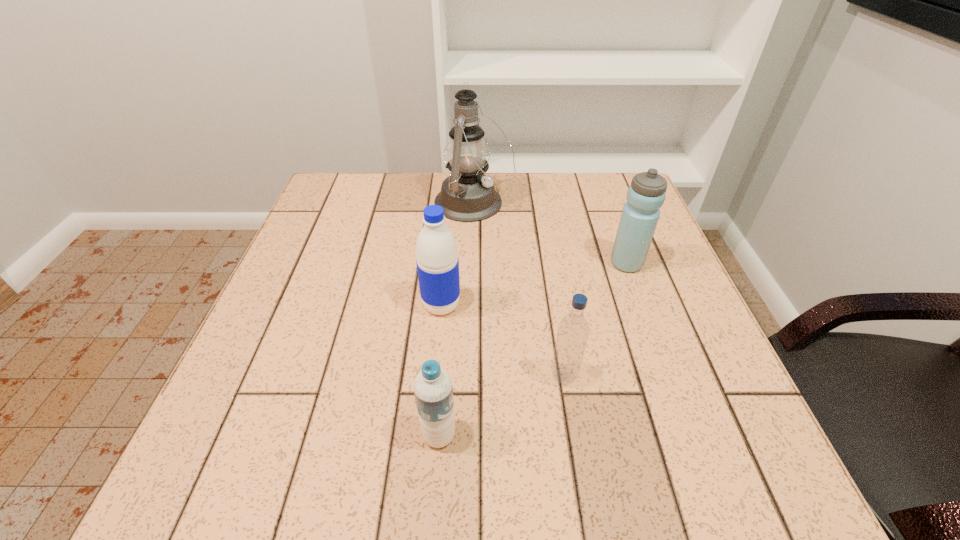
Identify the location of blank space located 0.190m on the right of the third nearest water bottle. Image resolution: width=960 pixels, height=540 pixels. (553, 305).

This screenshot has width=960, height=540. What are the coordinates of `vacant space situated 0.390m on the left of the third water bottle from left to right` in the screenshot? It's located at (329, 376).

The image size is (960, 540). Identify the location of vacant space situated on the label of the nearest object. (708, 435).

The height and width of the screenshot is (540, 960). I want to click on object at the far edge, so (467, 195).

Where is `object present at the near edge`? The height and width of the screenshot is (540, 960). object present at the near edge is located at coordinates (433, 389).

Find the location of `object that is at the right edge`. object that is at the right edge is located at coordinates (646, 194).

This screenshot has height=540, width=960. In the image, there is a desktop. In order to click on vacant region at the far edge in this screenshot , I will do `click(400, 175)`.

In the image, there is a desktop. Where is `vacant space at the near edge`? vacant space at the near edge is located at coordinates (628, 485).

In the image, there is a desktop. At what (x,y) coordinates should I click in order to perform the action: click on vacant space at the left edge. Please return your answer as a coordinate pair (x, y). This screenshot has height=540, width=960. Looking at the image, I should click on (324, 264).

This screenshot has height=540, width=960. In the image, there is a desktop. What are the coordinates of `free region at the right edge` in the screenshot? It's located at (662, 431).